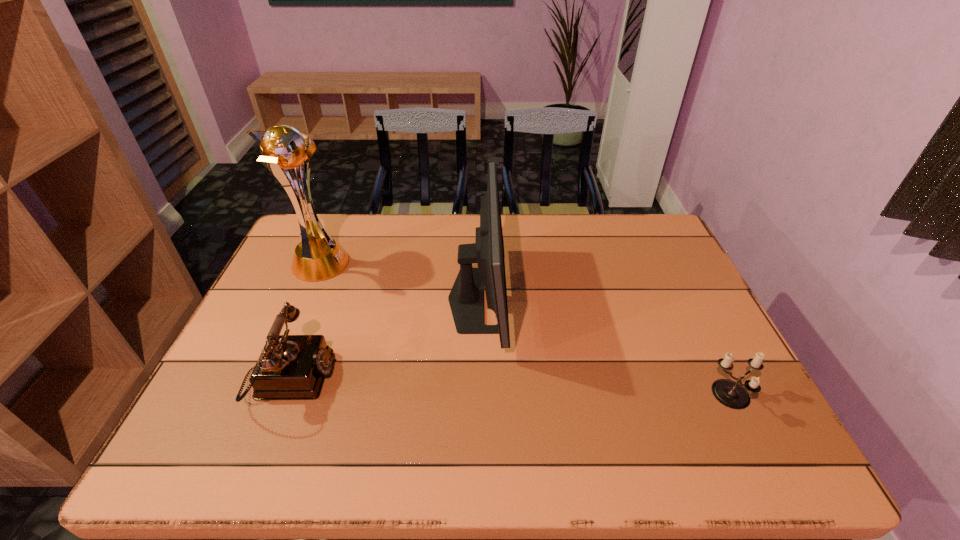
This screenshot has height=540, width=960. In order to click on trophy at the far edge in this screenshot , I will do `click(320, 257)`.

Find the location of a particular element. This screenshot has width=960, height=540. computer monitor positioned at the far edge is located at coordinates (466, 298).

This screenshot has width=960, height=540. Find the location of `trophy that is positioned at the left edge`. trophy that is positioned at the left edge is located at coordinates (320, 257).

Locate an element on the screen. This screenshot has width=960, height=540. telephone that is positioned at the left edge is located at coordinates (291, 367).

I want to click on object that is positioned at the right edge, so click(731, 394).

Locate an element on the screen. object at the far left corner is located at coordinates (320, 257).

The image size is (960, 540). I want to click on vacant region at the far edge of the desktop, so click(370, 226).

Locate an element on the screen. The width and height of the screenshot is (960, 540). vacant region at the near edge is located at coordinates coord(384,450).

In the image, there is a desktop. Where is `vacant space at the left edge`? vacant space at the left edge is located at coordinates (234, 364).

Find the location of a particular element. This screenshot has height=540, width=960. vacant space at the right edge of the desktop is located at coordinates (709, 357).